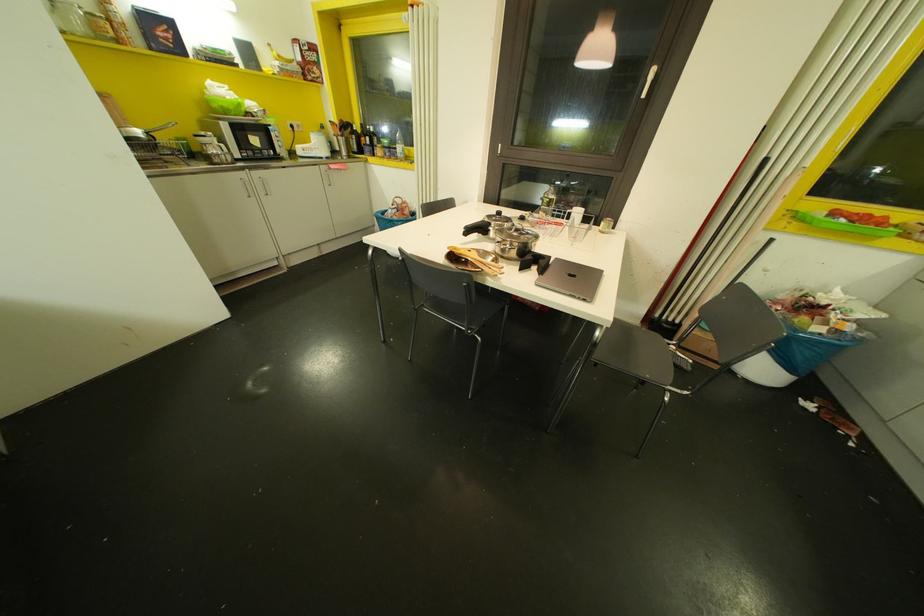
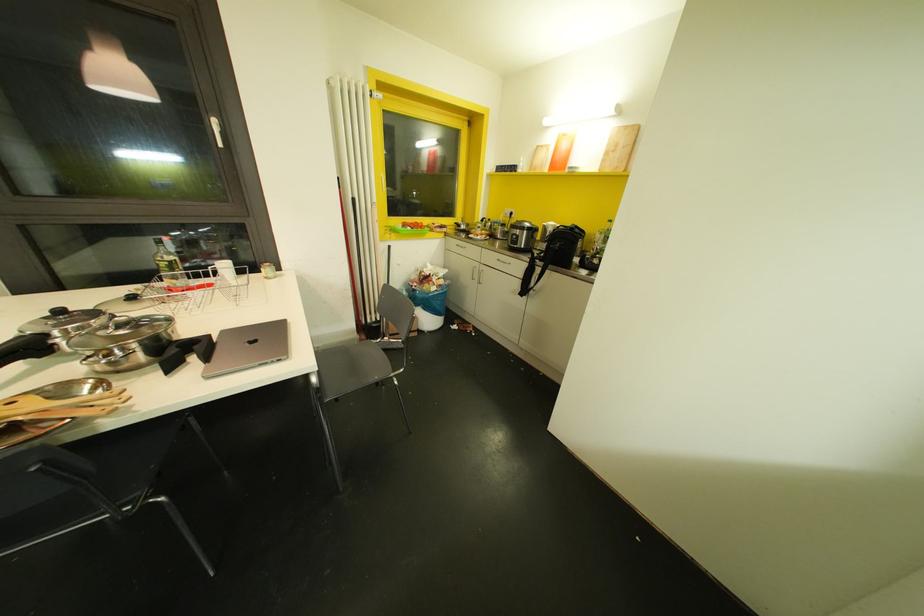
The point at [497,213] is marked in the first image. Where is the corresponding point in the second image?

(59, 310)